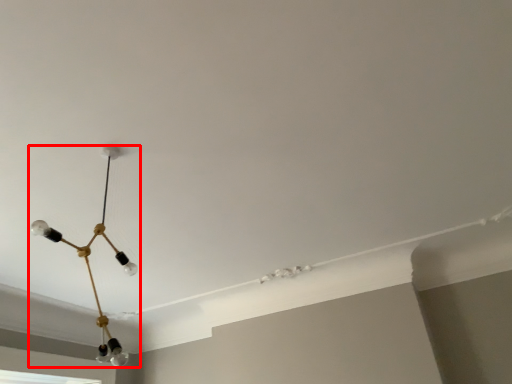
Question: Considering the relative positions of lamp (annotated by the red box) and window in the image provided, where is lamp (annotated by the red box) located with respect to the staircase?

Choices:
 (A) left
 (B) right

Answer: (B)